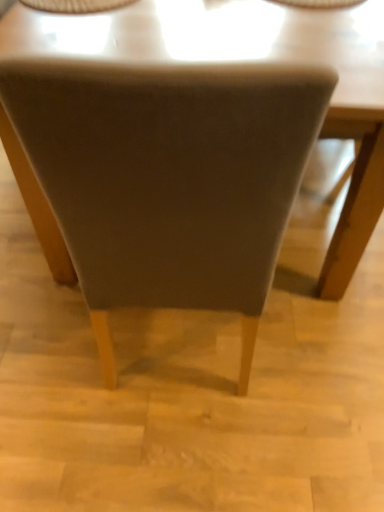
What do you see at coordinates (169, 178) in the screenshot? I see `velvet gray chair at center` at bounding box center [169, 178].

I want to click on velvet gray chair at center, so click(x=169, y=178).

Identify the location of velvet gray chair at center. pyautogui.click(x=169, y=178).